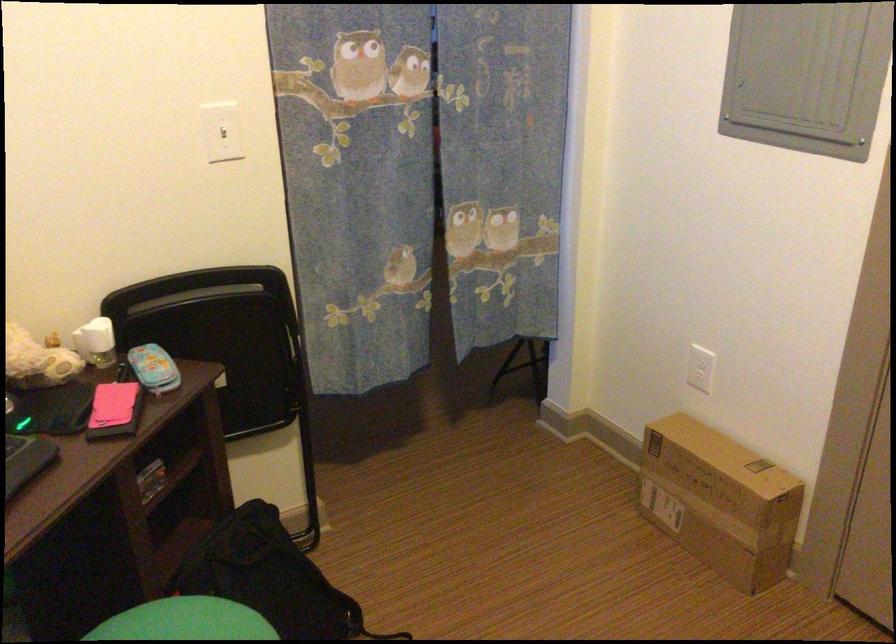
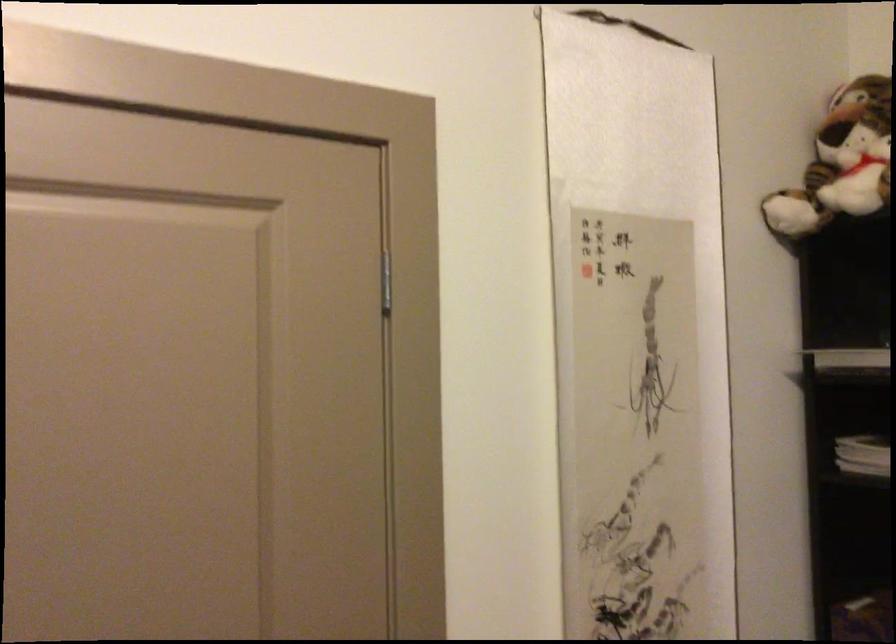
Question: The camera is either moving clockwise (left) or counter-clockwise (right) around the object. The first image is from the beginning of the video and the second image is from the end. Is the camera moving left or right when shooting the video?

Choices:
 (A) Left
 (B) Right

Answer: (A)